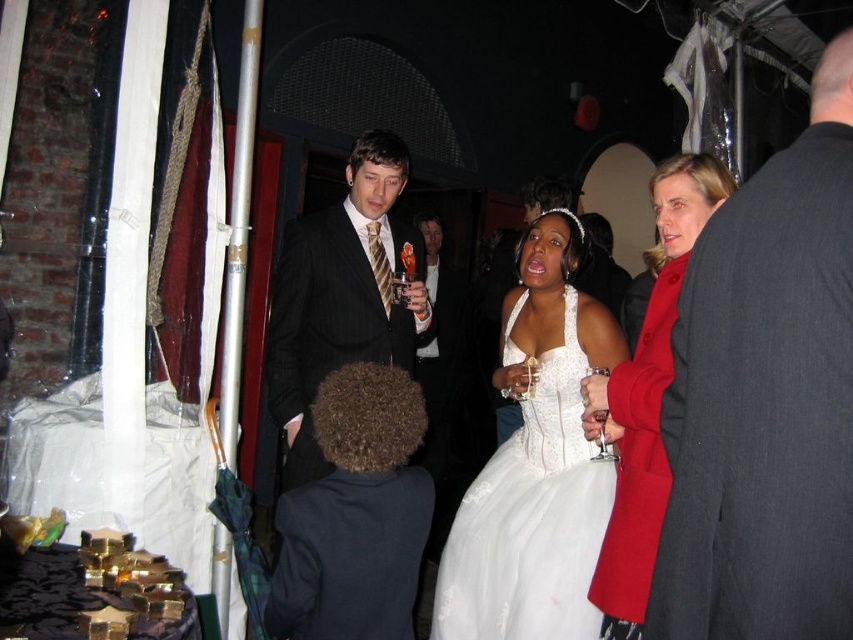
Is white lace dress at center thinner than dark brown curly hair at center?

In fact, white lace dress at center might be wider than dark brown curly hair at center.

Does white lace dress at center appear over dark brown curly hair at center?

Yes.

This screenshot has height=640, width=853. Find the location of `white lace dress at center`. white lace dress at center is located at coordinates (535, 465).

From the picture: Who is positioned more to the left, dark gray suit at right or white lace dress at center?

white lace dress at center

Does point (833, 481) come in front of point (462, 515)?

Yes, point (833, 481) is in front of point (462, 515).

Is point (701, 561) in front of point (561, 436)?

Yes, point (701, 561) is in front of point (561, 436).

Where is `dark gray suit at right`? The height and width of the screenshot is (640, 853). dark gray suit at right is located at coordinates (766, 397).

Does white lace dress at center appear on the left side of pinstripe suit at center?

Incorrect, white lace dress at center is not on the left side of pinstripe suit at center.

Consider the image. Between white lace dress at center and pinstripe suit at center, which one has more height?

With more height is white lace dress at center.

Is point (552, 432) less distant than point (316, 360)?

That is True.

The image size is (853, 640). I want to click on white lace dress at center, so click(535, 465).